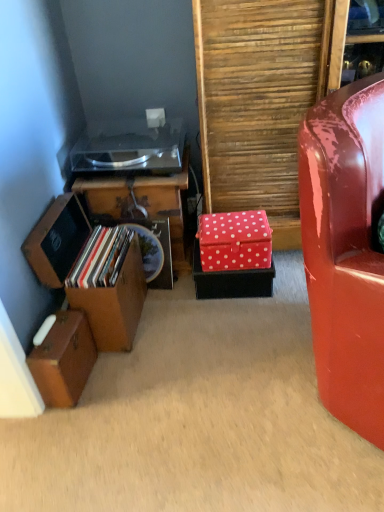
You are a GUI agent. You are given a task and a screenshot of the screen. Output one action in this format:
    pyautogui.click(x=<x>, y=<y>)
    Task: Click on the vacant area that is in front of wooden storage box at left, positioned as the second storage box in right-to-left order
    The height and width of the screenshot is (512, 384).
    Given the screenshot: What is the action you would take?
    pyautogui.click(x=130, y=365)